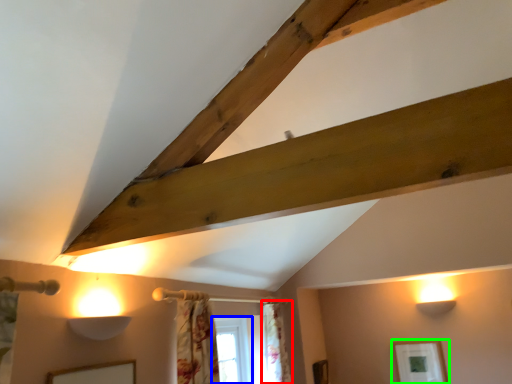
Question: Considering the real-world distances, which object is closest to curtain (highlighted by a red box)? window (highlighted by a blue box) or picture frame (highlighted by a green box).

Choices:
 (A) window
 (B) picture frame

Answer: (A)